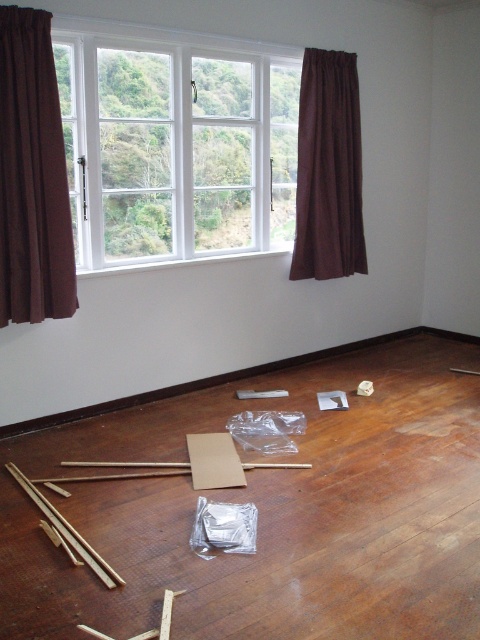
You are standing in the room and want to move from the brown wood floor at center to the white glass window at upper center. Which direction should you move to reach the window?

You should move to the left to reach the white glass window at upper center because the brown wood floor at center is to the right of it.

You are a painter standing in the room and want to paint the brown velvet curtain at left. To do this, you need to see the curtain clearly through the white glass window at upper center. Is the curtain visible through the window?

The brown velvet curtain at left is behind the white glass window at upper center, so it cannot be seen through the window because it is positioned behind it.

You are a contractor assessing the room layout. You need to place a large piece of equipment that requires more space than the white glass window at upper center. Can the brown wood floor at center accommodate it?

The brown wood floor at center is bigger than the white glass window at upper center, so yes, it can accommodate the equipment since the floor has more space available.